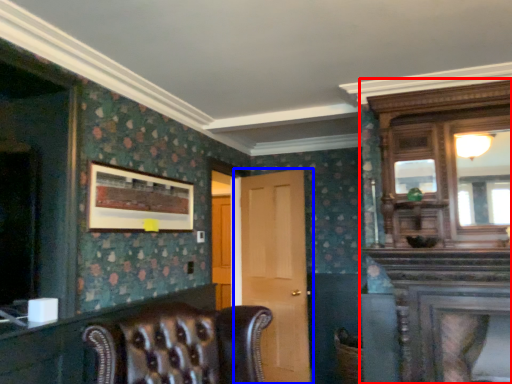
Question: Among these objects, which one is farthest to the camera, dresser (highlighted by a red box) or door (highlighted by a blue box)?

Choices:
 (A) dresser
 (B) door

Answer: (B)